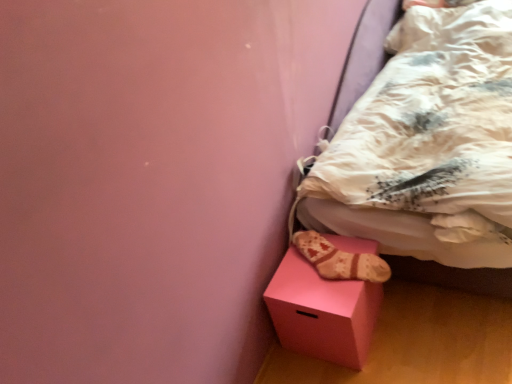
Where is `free point above pink matte cube at lower right (from a real-world perspective)`? The width and height of the screenshot is (512, 384). free point above pink matte cube at lower right (from a real-world perspective) is located at coordinates (318, 266).